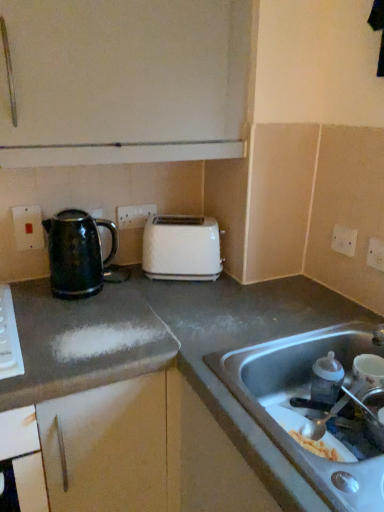
In order to click on empty space that is ontop of shiny metallic kettle at center-left, which is the second countertop in right-to-left order (from a real-world perspective) in this screenshot , I will do `click(87, 317)`.